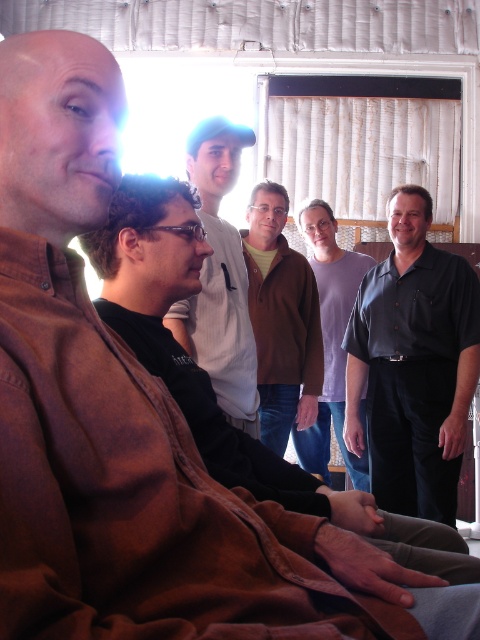
You are a photographer setting up for a group photo. You notice the black shirt at right and the white cotton shirt at center in the scene. Which shirt should you adjust in position to ensure both are visible in the frame, considering their heights?

The black shirt at right has a greater height compared to the white cotton shirt at center. To ensure both are visible, you should lower the camera angle slightly to accommodate the taller black shirt at right while keeping the white cotton shirt at center in view.

You are standing in the room and want to place a small decoration between the two points, point (217, 275) and point (296, 253). Which point should the decoration be closer to in order to be nearer to the camera?

The decoration should be closer to point (217, 275) because it is nearer to the camera compared to point (296, 253).